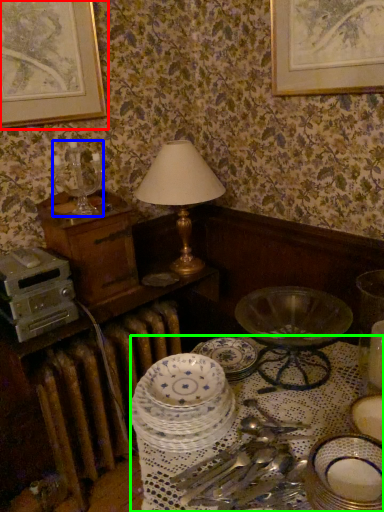
Question: Which object is positioned closest to picture frame (highlighted by a red box)? Select from candle holder (highlighted by a blue box) and round table (highlighted by a green box).

Choices:
 (A) candle holder
 (B) round table

Answer: (A)